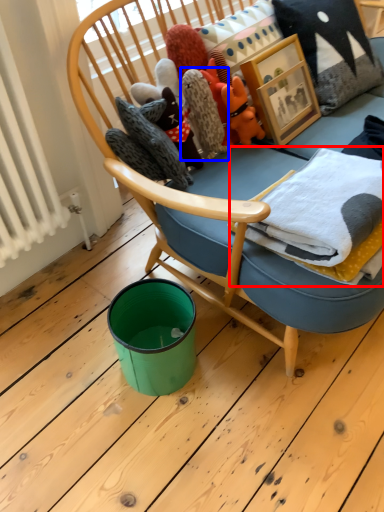
Question: Which object is further to the camera taking this photo, material (highlighted by a red box) or cloth (highlighted by a blue box)?

Choices:
 (A) material
 (B) cloth

Answer: (B)